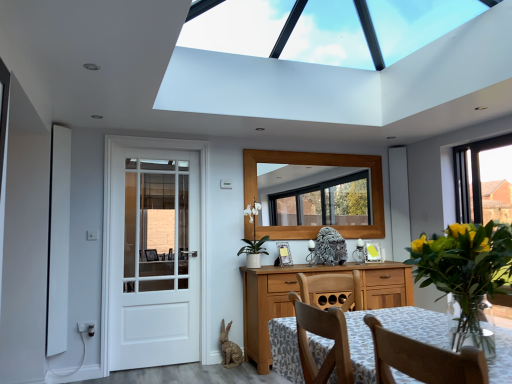
Question: From a real-world perspective, is translucent glass vase at right positioned above or below wooden frame mirror at center?

Choices:
 (A) below
 (B) above

Answer: (A)

Question: Is translucent glass vase at right situated inside wooden frame mirror at center or outside?

Choices:
 (A) inside
 (B) outside

Answer: (B)

Question: Considering the real-world distances, which object is closest to the white painted wood door at left?

Choices:
 (A) wooden frame mirror at center
 (B) wooden table at center
 (C) wooden cabinet at center
 (D) translucent glass vase at right

Answer: (C)

Question: Which object is positioned farthest from the wooden cabinet at center?

Choices:
 (A) wooden table at center
 (B) wooden frame mirror at center
 (C) translucent glass vase at right
 (D) white painted wood door at left

Answer: (C)